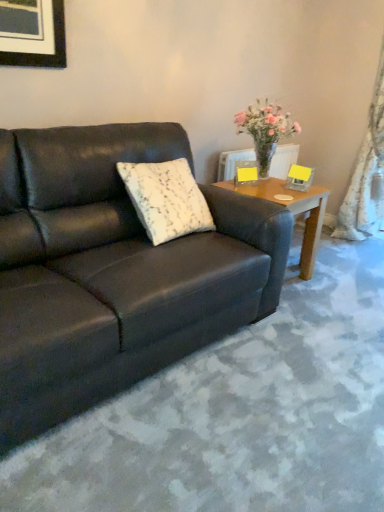
Question: Does wooden side table at right have a greater height compared to white lace curtain at right?

Choices:
 (A) yes
 (B) no

Answer: (B)

Question: Are wooden side table at right and white lace curtain at right located far from each other?

Choices:
 (A) no
 (B) yes

Answer: (B)

Question: Can you confirm if wooden side table at right is wider than white lace curtain at right?

Choices:
 (A) no
 (B) yes

Answer: (B)

Question: From a real-world perspective, is wooden side table at right over white lace curtain at right?

Choices:
 (A) yes
 (B) no

Answer: (B)

Question: Is wooden side table at right thinner than white lace curtain at right?

Choices:
 (A) yes
 (B) no

Answer: (B)

Question: Is white lace curtain at right in front of or behind white textured pillow at center in the image?

Choices:
 (A) behind
 (B) front

Answer: (A)

Question: In the image, is white lace curtain at right on the left side or the right side of white textured pillow at center?

Choices:
 (A) left
 (B) right

Answer: (B)

Question: Considering the positions of point (365, 237) and point (185, 200), is point (365, 237) closer or farther from the camera than point (185, 200)?

Choices:
 (A) farther
 (B) closer

Answer: (A)

Question: In terms of width, does white lace curtain at right look wider or thinner when compared to white textured pillow at center?

Choices:
 (A) thin
 (B) wide

Answer: (A)

Question: From the image's perspective, is white lace curtain at right located above or below matte black couch at center?

Choices:
 (A) above
 (B) below

Answer: (A)

Question: In terms of width, does white lace curtain at right look wider or thinner when compared to matte black couch at center?

Choices:
 (A) wide
 (B) thin

Answer: (B)

Question: Do you think white lace curtain at right is within matte black couch at center, or outside of it?

Choices:
 (A) outside
 (B) inside

Answer: (A)

Question: Is white lace curtain at right to the left or to the right of matte black couch at center in the image?

Choices:
 (A) right
 (B) left

Answer: (A)

Question: From a real-world perspective, is white textured pillow at center positioned above or below wooden side table at right?

Choices:
 (A) below
 (B) above

Answer: (B)

Question: Is white textured pillow at center bigger or smaller than wooden side table at right?

Choices:
 (A) small
 (B) big

Answer: (A)